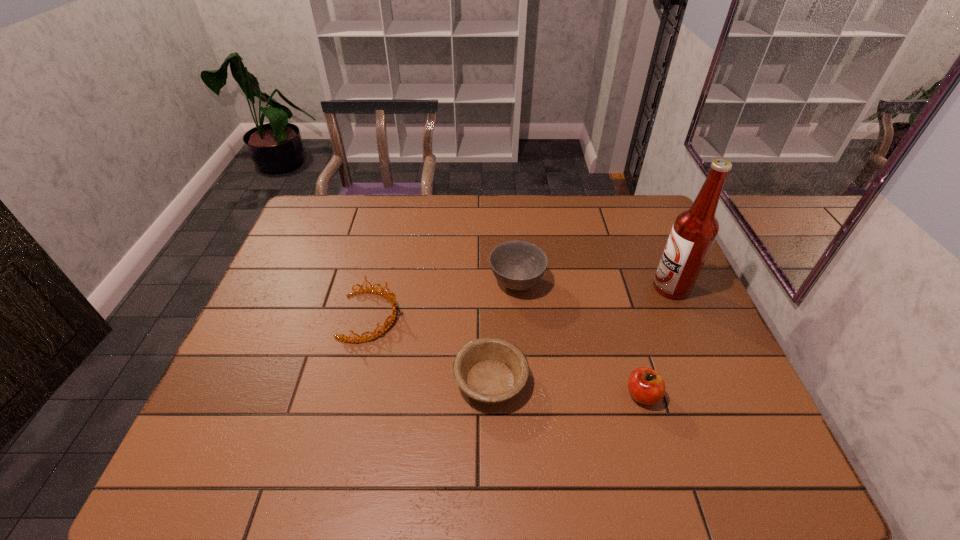
This screenshot has height=540, width=960. I want to click on free space at the far right corner, so [x=622, y=195].

You are a GUI agent. You are given a task and a screenshot of the screen. Output one action in this format:
    pyautogui.click(x=<x>, y=<y>)
    Task: Click on the empty location between the shorter bowl and the alcohol
    Image resolution: width=960 pixels, height=540 pixels.
    Given the screenshot: What is the action you would take?
    pyautogui.click(x=581, y=334)

Find the location of a particular element. Image resolution: width=960 pixels, height=540 pixels. unoccupied area between the shortest object and the alcohol is located at coordinates (581, 334).

Where is `vacant space that is in between the nearer bowl and the tallest object`? Image resolution: width=960 pixels, height=540 pixels. vacant space that is in between the nearer bowl and the tallest object is located at coordinates (581, 334).

The image size is (960, 540). I want to click on unoccupied position between the taller bowl and the fourth object from left to right, so click(580, 339).

Where is `free space between the apple and the taller bowl`? free space between the apple and the taller bowl is located at coordinates (580, 339).

Where is `unoccupied area between the alcohol and the leftmost object`? The width and height of the screenshot is (960, 540). unoccupied area between the alcohol and the leftmost object is located at coordinates (520, 302).

Identify the location of free spot between the taller bowl and the tallest object. This screenshot has height=540, width=960. (594, 285).

Locate an element on the screen. This screenshot has height=540, width=960. unoccupied area between the tallest object and the farther bowl is located at coordinates (594, 285).

The width and height of the screenshot is (960, 540). What are the coordinates of `object that is the nearest to the second object from right to left` in the screenshot? It's located at (490, 370).